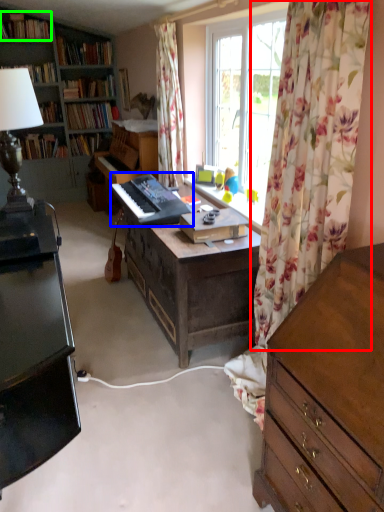
Question: Which object is the closest to the curtain (highlighted by a red box)? Choose among these: musical keyboard (highlighted by a blue box) or book (highlighted by a green box).

Choices:
 (A) musical keyboard
 (B) book

Answer: (A)